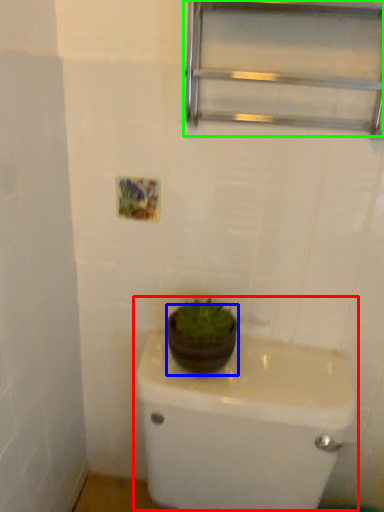
Question: Considering the real-world distances, which object is farthest from sink (highlighted by a red box)? flowerpot (highlighted by a blue box) or shelf (highlighted by a green box)?

Choices:
 (A) flowerpot
 (B) shelf

Answer: (B)